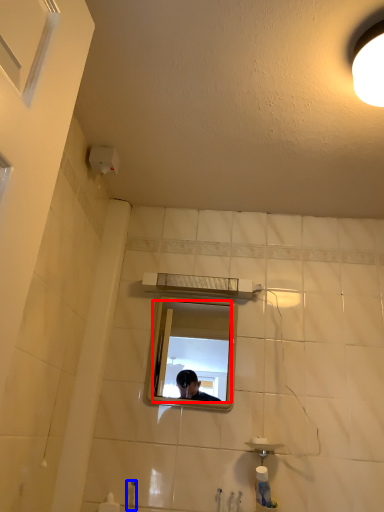
Question: Which point is further to the camera, mirror (highlighted by a red box) or faucet (highlighted by a blue box)?

Choices:
 (A) mirror
 (B) faucet

Answer: (A)